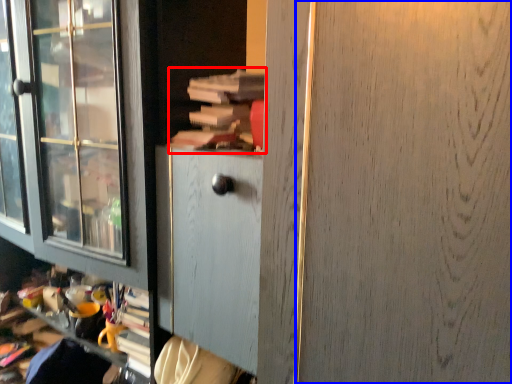
Question: Which object is closer to the camera taking this photo, book (highlighted by a red box) or screen door (highlighted by a blue box)?

Choices:
 (A) book
 (B) screen door

Answer: (B)